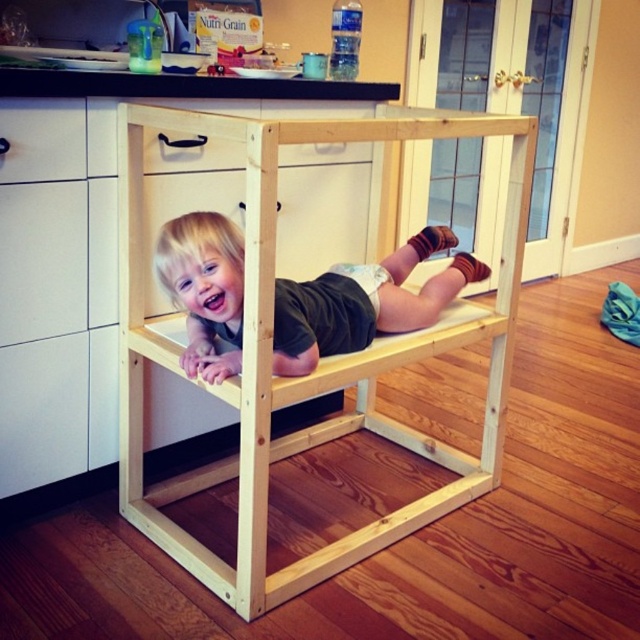
You are designing a new play area and need to ensure that the space between the matte black toddler at center and the white matte drawer at upper left is sufficient for a 24 inch wide toy box. Based on the scene description, can the toy box fit between them?

The matte black toddler at center might be wider than the white matte drawer at upper left, so the space between them may not be sufficient for a 24 inch wide toy box. Further measurements would be needed to confirm.

You are a parent trying to place a new toy on the floor between the matte black toddler at center and the white matte drawer at upper left. Considering the size of both objects, which one will the toy be closer to?

The toy will be closer to the white matte drawer at upper left because the matte black toddler at center is larger in size, meaning it occupies more space, so the distance between them would be measured from the edges. Since the toddler is bigger, the midpoint between them would be nearer to the smaller drawer.

From the picture: You are a parent trying to place a 20 cm tall toy on the floor between the natural wood step stool at center and the matte black toddler at center. Can you fit the toy there without it overlapping either object?

The natural wood step stool at center is larger in size than the matte black toddler at center, but without specific measurements of the space between them, it is impossible to determine if the 20 cm tall toy will fit without overlapping. Additional information about the distance between the two objects is needed to provide an accurate answer.